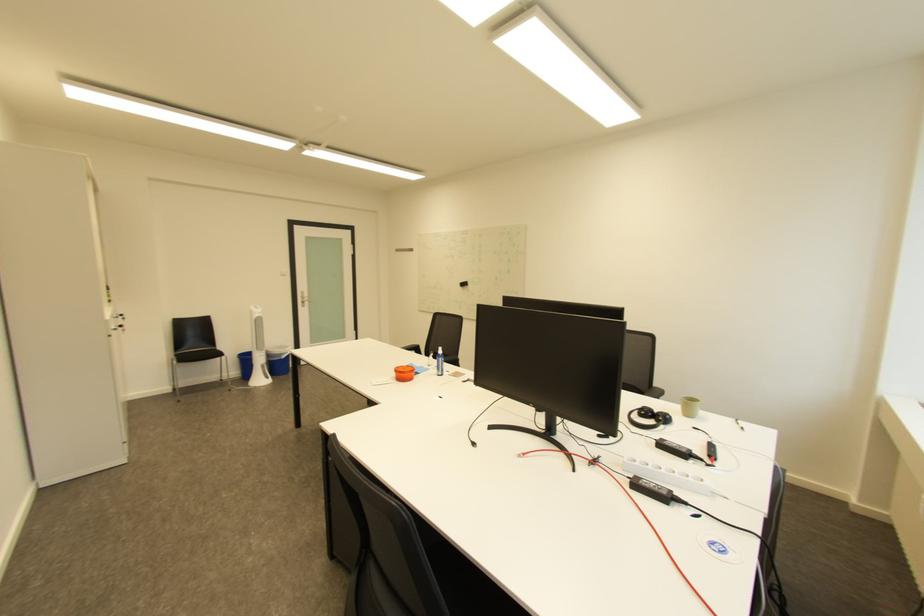
The location [404,373] corresponds to which object?

This point indicates the orange lidded container.